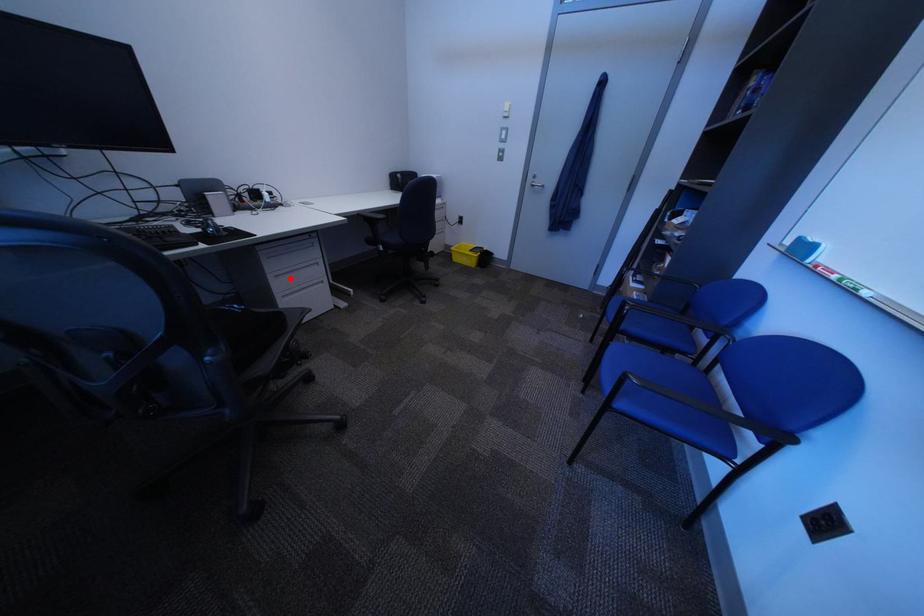
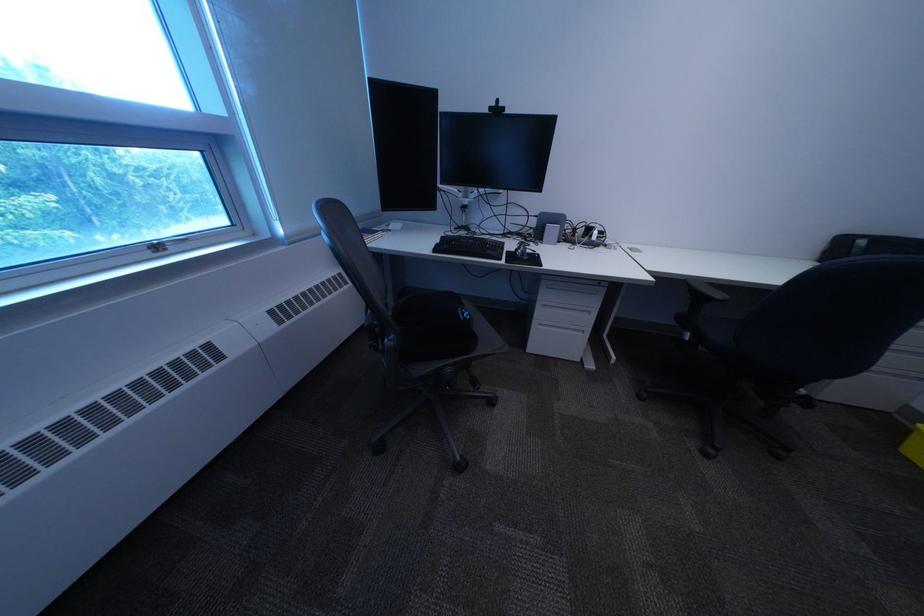
Question: I am providing you with two images of the same scene from different viewpoints. A red point is shown in image1. For the corresponding object point in image2, is it positioned nearer or farther from the camera?

Choices:
 (A) Nearer
 (B) Farther

Answer: (B)